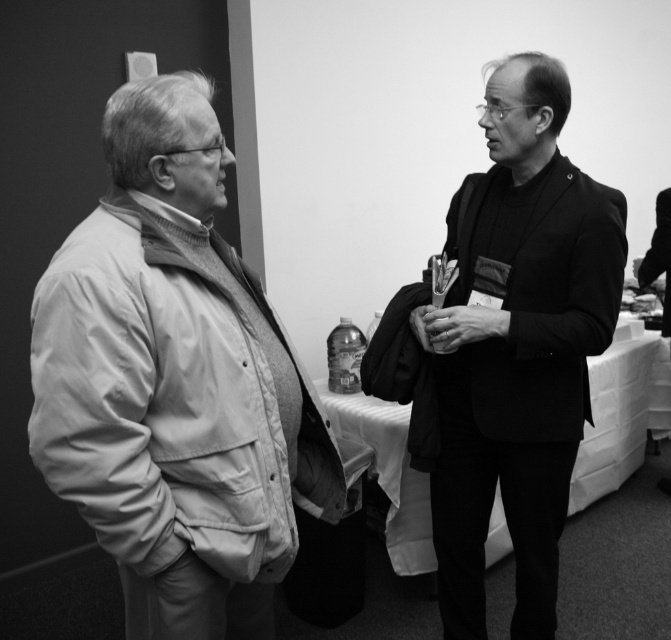
You are a tailor who needs to determine which garment requires more fabric between the smooth black suit at center and the smooth black jacket at right. Which one would need more fabric?

The smooth black suit at center requires more fabric because it has a larger size compared to the smooth black jacket at right.

You are planning to sit between the smooth black suit at center and the smooth black jacket at right. Which side should you choose to ensure there is enough space for your chair?

The smooth black suit at center is wider than the smooth black jacket at right, so you should choose the side of the smooth black jacket at right to have more space for your chair.

You are designing a rack to display the matte beige jacket at left and the smooth black jacket at right. The rack has a total width of 1.2 meters. If the jackets need to be placed side by side with equal spacing between them and the rack edges, will both jackets fit on the rack?

The matte beige jacket at left is wider than the smooth black jacket at right. Since the rack has a total width of 1.2 meters, and the jackets must be placed side by side with equal spacing, the combined width of both jackets plus the spacing must not exceed 1.2 meters. However, without knowing the exact widths of the jackets or the required spacing, it is impossible to definitively determine if they will fit. Additional measurements are needed.